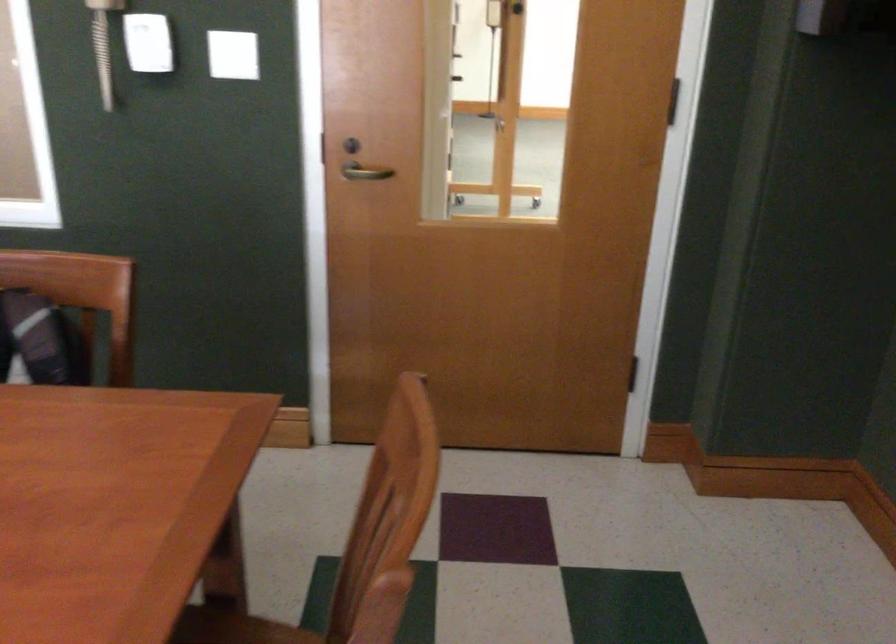
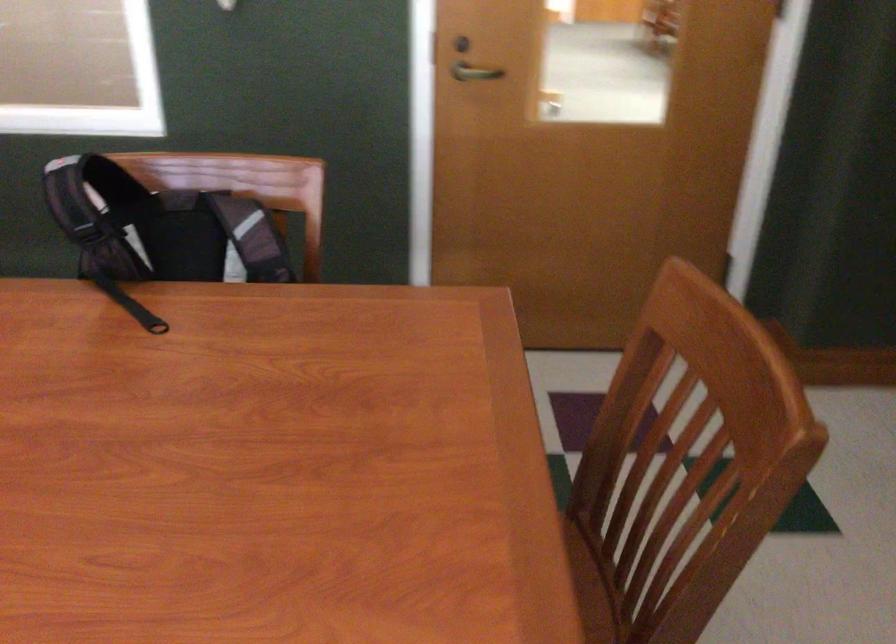
Where in the second image is the point corresponding to point (340, 146) from the first image?

(460, 44)